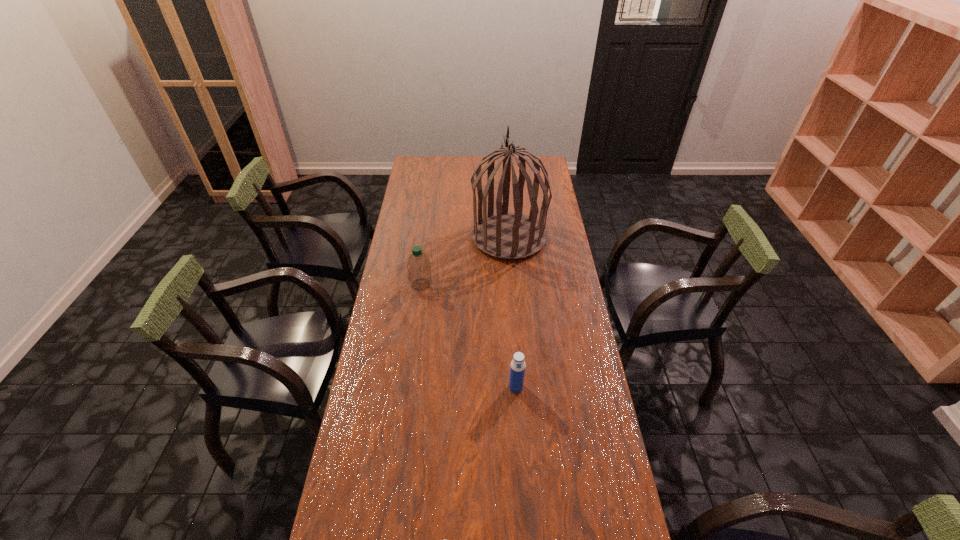
Point out which object is positioned as the third nearest to the third nearest object. Please provide its 2D coordinates. Your answer should be formatted as a tuple, i.e. [(x, y)], where the tuple contains the x and y coordinates of a point satisfying the conditions above.

[(444, 539)]

Identify the location of water bottle that stands as the second closest to the third farthest object. Image resolution: width=960 pixels, height=540 pixels. (419, 267).

Identify which water bottle is located as the second nearest to the second object from left to right. Please provide its 2D coordinates. Your answer should be formatted as a tuple, i.e. [(x, y)], where the tuple contains the x and y coordinates of a point satisfying the conditions above.

[(419, 267)]

The width and height of the screenshot is (960, 540). I want to click on vacant space that satisfies the following two spatial constraints: 1. on the front side of the rightmost water bottle; 2. on the left side of the leftmost water bottle, so click(407, 387).